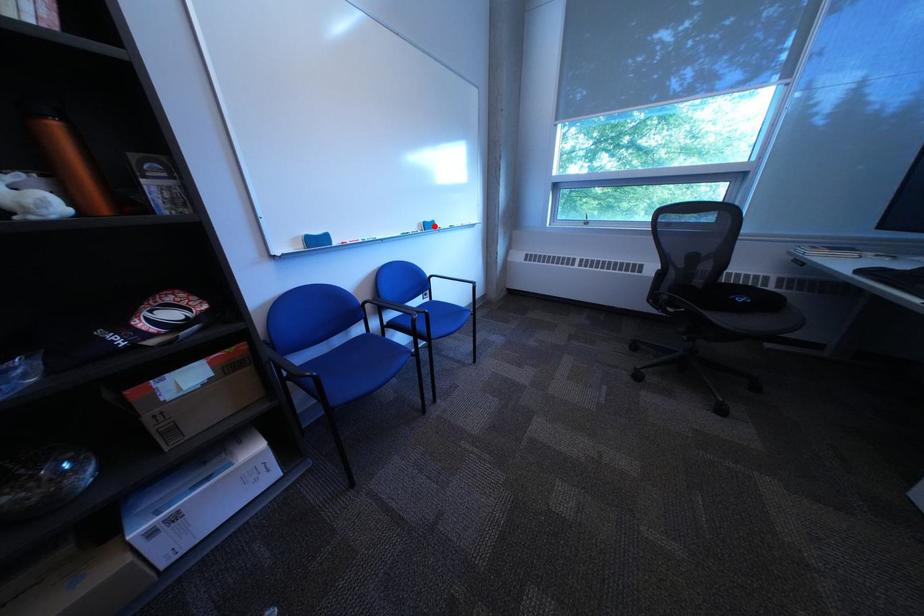
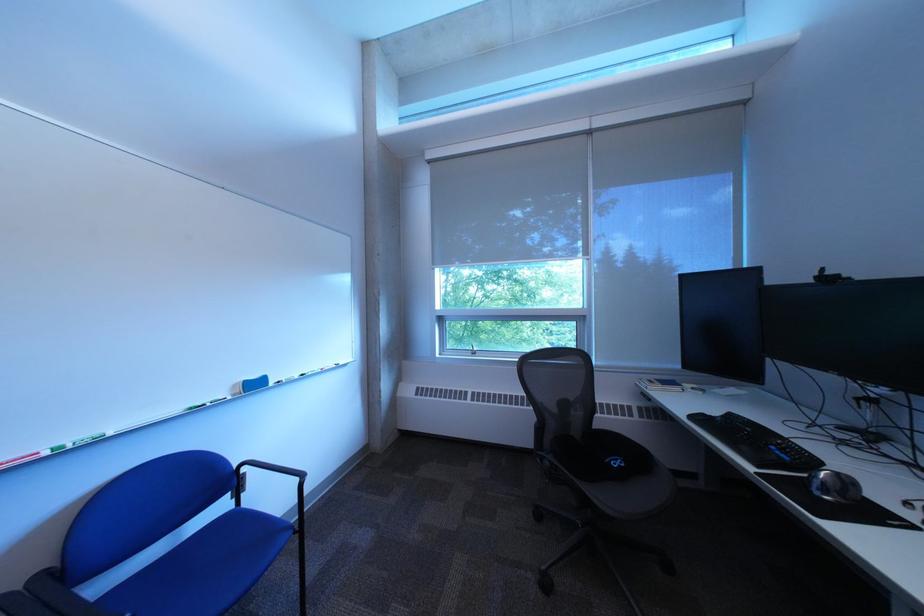
The point at the highlighted location is marked in the first image. Where is the corresponding point in the second image?

(249, 387)